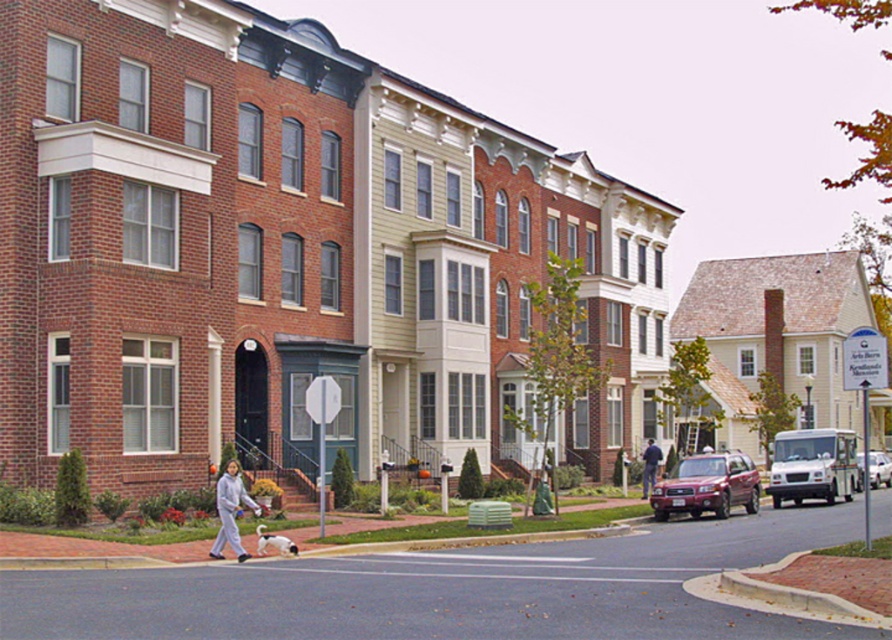
You are a delivery person who needs to deliver a package to the gray fleece jacket at lower center, who is currently walking a dog across the street. Your delivery vehicle is the matte red suv at center. Can you safely hand over the package while staying inside the vehicle without exiting?

The matte red suv at center and gray fleece jacket at lower center are 16.71 meters apart, so no, you cannot safely hand over the package while staying inside the vehicle since the distance is too large to reach.

You are a pedestrian standing at the crosswalk. You see a metallic silver sedan at center and dark gray pants at center. Which object is closer to your right side?

The metallic silver sedan at center is closer to your right side because it is positioned to the right of dark gray pants at center.